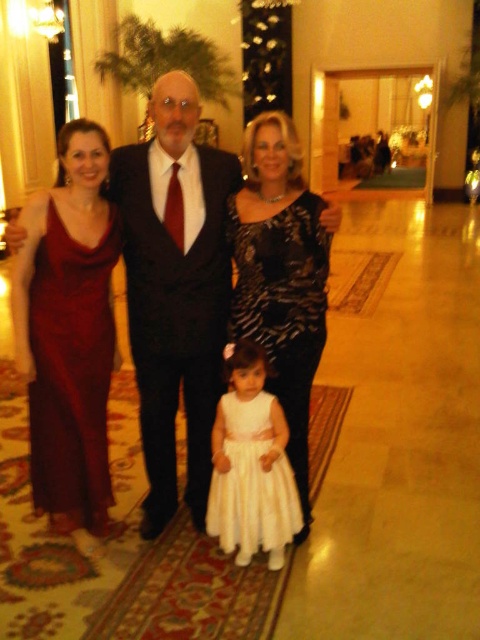
Question: Which point is closer to the camera taking this photo?

Choices:
 (A) (282, 198)
 (B) (206, 461)

Answer: (A)

Question: Does black textured dress at center have a larger size compared to white satin dress at center?

Choices:
 (A) no
 (B) yes

Answer: (B)

Question: Which object is positioned closest to the white satin dress at center?

Choices:
 (A) black textured dress at center
 (B) dark blue wool suit at center
 (C) matte black suit at center

Answer: (A)

Question: Which object is the closest to the matte red dress at left?

Choices:
 (A) dark blue wool suit at center
 (B) black textured dress at center
 (C) white satin dress at center

Answer: (A)

Question: Can you confirm if dark blue wool suit at center is smaller than black textured dress at center?

Choices:
 (A) no
 (B) yes

Answer: (A)

Question: Is matte black suit at center positioned before white satin dress at center?

Choices:
 (A) no
 (B) yes

Answer: (A)